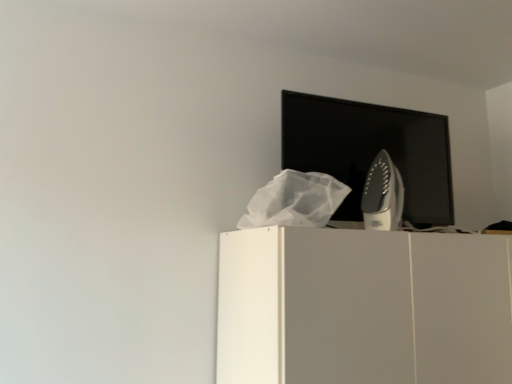
Measure the distance between point [229,344] and camera.

A distance of 4.51 feet exists between point [229,344] and camera.

This screenshot has width=512, height=384. In order to click on black glossy computer monitor at upper center in this screenshot , I will do `click(371, 151)`.

Is white matte cabinet at upper center smaller than satin silver iron at upper right?

No, white matte cabinet at upper center is not smaller than satin silver iron at upper right.

Considering the sizes of objects white matte cabinet at upper center and satin silver iron at upper right in the image provided, who is wider, white matte cabinet at upper center or satin silver iron at upper right?

white matte cabinet at upper center is wider.

From the image's perspective, which one is positioned lower, white matte cabinet at upper center or satin silver iron at upper right?

white matte cabinet at upper center appears lower in the image.

Would you say black glossy computer monitor at upper center is a long distance from satin silver iron at upper right?

They are positioned close to each other.

Is point (287, 148) positioned before point (378, 160)?

Yes.

In the scene shown: How different are the orientations of black glossy computer monitor at upper center and satin silver iron at upper right in degrees?

The angle between the facing direction of black glossy computer monitor at upper center and the facing direction of satin silver iron at upper right is 1.4 degrees.

Which object is closer to the camera, satin silver iron at upper right or black glossy computer monitor at upper center?

satin silver iron at upper right.

Is satin silver iron at upper right directly adjacent to black glossy computer monitor at upper center?

There is a gap between satin silver iron at upper right and black glossy computer monitor at upper center.

Is point (385, 225) closer or farther from the camera than point (413, 192)?

Clearly, point (385, 225) is closer to the camera than point (413, 192).

Where is `home appliance below the black glossy computer monitor at upper center (from a real-world perspective)`? The height and width of the screenshot is (384, 512). home appliance below the black glossy computer monitor at upper center (from a real-world perspective) is located at coordinates (383, 195).

Which of these two, white matte cabinet at upper center or black glossy computer monitor at upper center, stands taller?

white matte cabinet at upper center is taller.

Considering their positions, is white matte cabinet at upper center located in front of or behind black glossy computer monitor at upper center?

white matte cabinet at upper center is in front of black glossy computer monitor at upper center.

From the image's perspective, between white matte cabinet at upper center and black glossy computer monitor at upper center, who is located below?

white matte cabinet at upper center, from the image's perspective.

Is satin silver iron at upper right beside white matte cabinet at upper center?

No, satin silver iron at upper right is not making contact with white matte cabinet at upper center.

Relative to white matte cabinet at upper center, is satin silver iron at upper right in front or behind?

In the image, satin silver iron at upper right appears behind white matte cabinet at upper center.

Consider the image. Can you tell me how much satin silver iron at upper right and white matte cabinet at upper center differ in facing direction?

satin silver iron at upper right and white matte cabinet at upper center are facing 0.271 degrees away from each other.

Who is shorter, satin silver iron at upper right or white matte cabinet at upper center?

satin silver iron at upper right is shorter.

Which of these two, black glossy computer monitor at upper center or white matte cabinet at upper center, is bigger?

With larger size is white matte cabinet at upper center.

Which of these two, black glossy computer monitor at upper center or white matte cabinet at upper center, is wider?

Wider between the two is white matte cabinet at upper center.

Do you think black glossy computer monitor at upper center is within white matte cabinet at upper center, or outside of it?

black glossy computer monitor at upper center is not inside white matte cabinet at upper center, it's outside.

Is point (302, 134) farther from camera compared to point (309, 307)?

Yes, point (302, 134) is behind point (309, 307).

What are the coordinates of `home appliance above the white matte cabinet at upper center (from the image's perspective)` in the screenshot? It's located at (383, 195).

Locate an element on the screen. The height and width of the screenshot is (384, 512). home appliance that is below the black glossy computer monitor at upper center (from the image's perspective) is located at coordinates (383, 195).

Looking at the image, which one is located further to satin silver iron at upper right, white matte cabinet at upper center or black glossy computer monitor at upper center?

white matte cabinet at upper center is positioned further to the anchor satin silver iron at upper right.

Estimate the real-world distances between objects in this image. Which object is further from black glossy computer monitor at upper center, white matte cabinet at upper center or satin silver iron at upper right?

The object further to black glossy computer monitor at upper center is white matte cabinet at upper center.

Which object lies further to the anchor point satin silver iron at upper right, black glossy computer monitor at upper center or white matte cabinet at upper center?

The object further to satin silver iron at upper right is white matte cabinet at upper center.

When comparing their distances from black glossy computer monitor at upper center, does satin silver iron at upper right or white matte cabinet at upper center seem closer?

satin silver iron at upper right is positioned closer to the anchor black glossy computer monitor at upper center.

From the image, which object appears to be farther from white matte cabinet at upper center, black glossy computer monitor at upper center or satin silver iron at upper right?

black glossy computer monitor at upper center lies further to white matte cabinet at upper center than the other object.

From the image, which object appears to be farther from white matte cabinet at upper center, satin silver iron at upper right or black glossy computer monitor at upper center?

black glossy computer monitor at upper center is positioned further to the anchor white matte cabinet at upper center.

You are a GUI agent. You are given a task and a screenshot of the screen. Output one action in this format:
    pyautogui.click(x=<x>, y=<y>)
    Task: Click on the home appliance between black glossy computer monitor at upper center and white matte cabinet at upper center vertically
    The height and width of the screenshot is (384, 512).
    Given the screenshot: What is the action you would take?
    pyautogui.click(x=383, y=195)